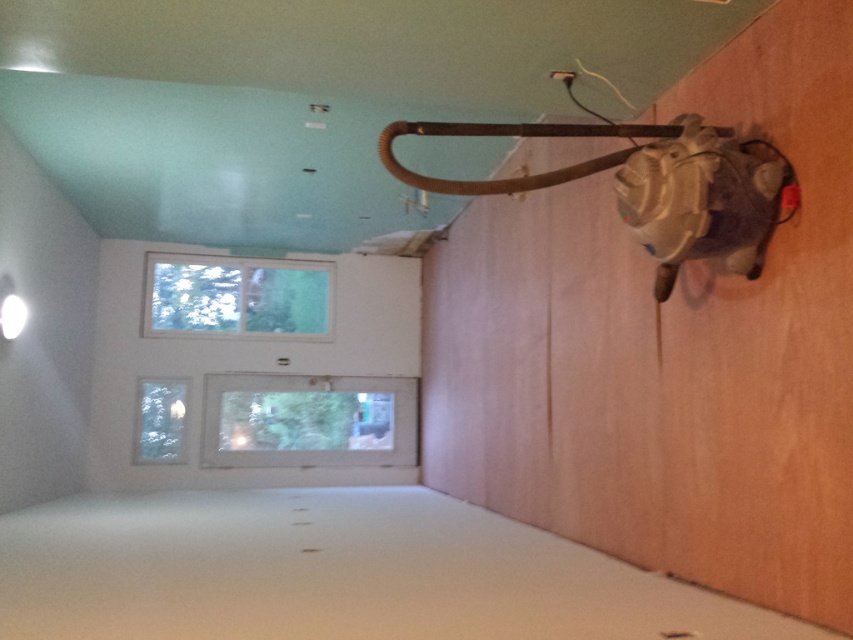
Does clear glass window at center appear on the right side of clear glass window at lower left?

Yes, clear glass window at center is to the right of clear glass window at lower left.

Is point (345, 408) farther from camera compared to point (167, 417)?

Yes.

Between point (343, 442) and point (160, 406), which one is positioned in front?

Point (160, 406)

Identify the location of clear glass window at center. This screenshot has height=640, width=853. coord(308,420).

Does clear glass window at center have a greater width compared to clear glass window at upper center?

Correct, the width of clear glass window at center exceeds that of clear glass window at upper center.

Which is in front, point (380, 396) or point (321, 323)?

Point (380, 396)

Where is `clear glass window at center`? clear glass window at center is located at coordinates (308, 420).

Who is lower down, clear glass window at upper center or clear glass window at lower left?

Positioned lower is clear glass window at lower left.

Is clear glass window at upper center closer to the viewer compared to clear glass window at lower left?

No, it is not.

Describe the element at coordinates (235, 296) in the screenshot. The width and height of the screenshot is (853, 640). I see `clear glass window at upper center` at that location.

At what (x,y) coordinates should I click in order to perform the action: click on clear glass window at upper center. Please return your answer as a coordinate pair (x, y). Looking at the image, I should click on (235, 296).